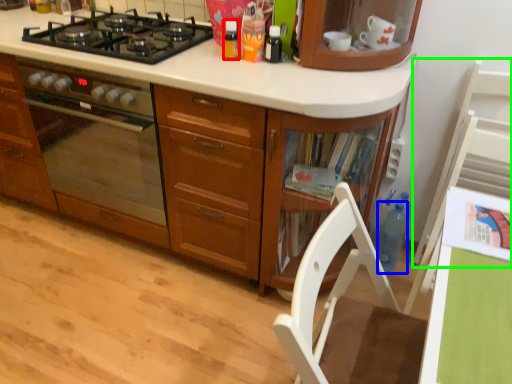
Question: Based on their relative distances, which object is nearer to kitchen appliance (highlighted by a red box)? Choose from bottle (highlighted by a blue box) and chair (highlighted by a green box).

Choices:
 (A) bottle
 (B) chair

Answer: (B)